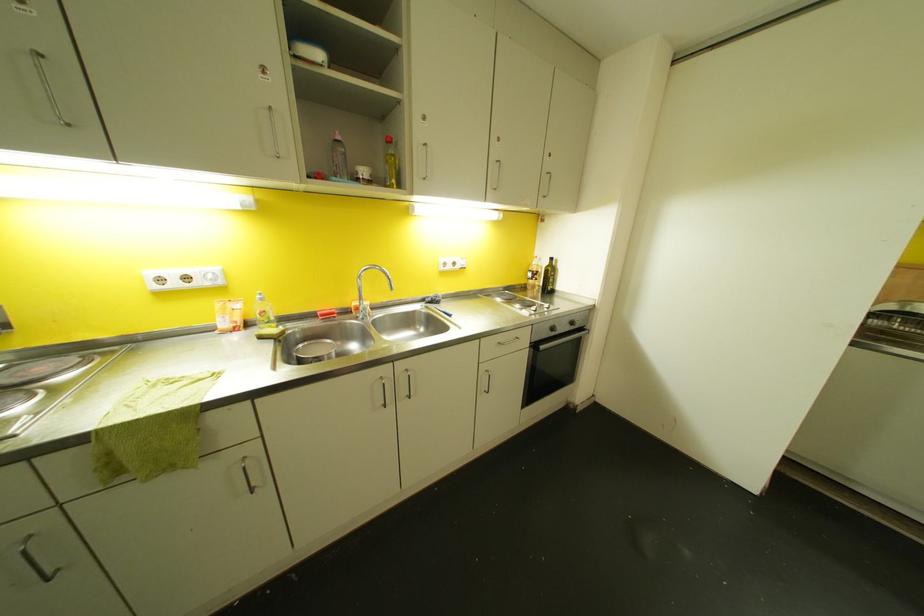
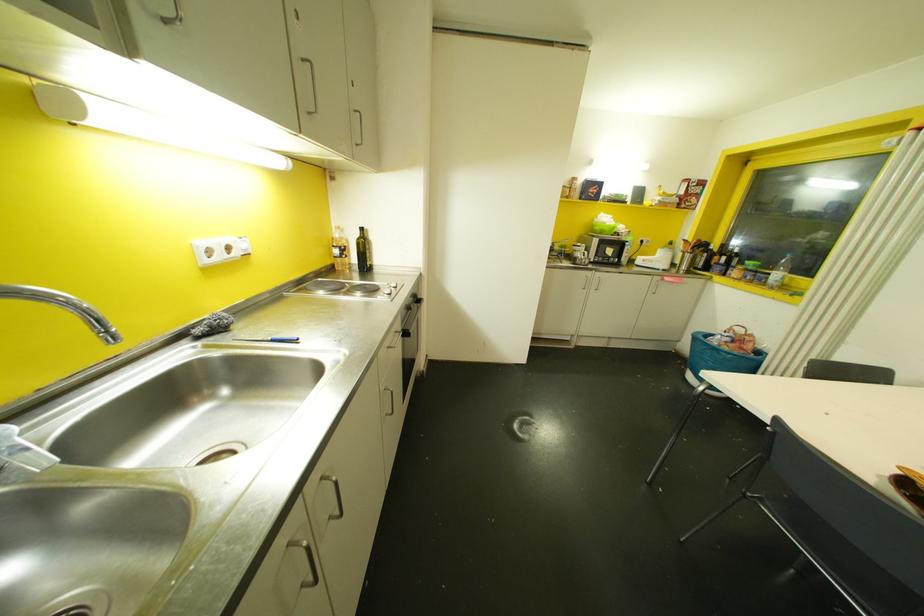
Locate, in the second image, the point that corresponds to pixel 454 262 in the first image.

(227, 248)